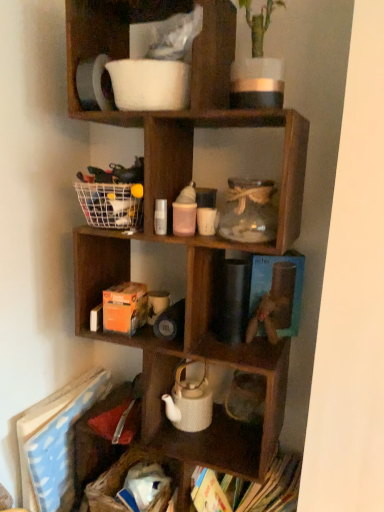
Question: Is white woven basket at lower left looking in the opposite direction of hardcover book at bottom right, which appears as the second book when viewed from the left?

Choices:
 (A) no
 (B) yes

Answer: (A)

Question: Is white woven basket at lower left at the right side of hardcover book at bottom right, which is the 1th book in right-to-left order?

Choices:
 (A) yes
 (B) no

Answer: (B)

Question: Considering the relative sizes of white woven basket at lower left and hardcover book at bottom right, which is the 1th book in right-to-left order, in the image provided, is white woven basket at lower left smaller than hardcover book at bottom right, which is the 1th book in right-to-left order,?

Choices:
 (A) no
 (B) yes

Answer: (B)

Question: Can you confirm if white woven basket at lower left is taller than hardcover book at bottom right, which appears as the second book when viewed from the left?

Choices:
 (A) no
 (B) yes

Answer: (A)

Question: Is white woven basket at lower left closer to the viewer compared to hardcover book at bottom right, which is the 1th book in right-to-left order?

Choices:
 (A) no
 (B) yes

Answer: (A)

Question: Can you confirm if white woven basket at lower left is thinner than hardcover book at bottom right, which is the 1th book in right-to-left order?

Choices:
 (A) no
 (B) yes

Answer: (B)

Question: Is wooden cube at center, acting as the 2th shelf starting from the top, at the back of white woven basket at lower left?

Choices:
 (A) no
 (B) yes

Answer: (B)

Question: From a real-world perspective, does white woven basket at lower left stand above wooden cube at center, acting as the 2th shelf starting from the top?

Choices:
 (A) yes
 (B) no

Answer: (B)

Question: Is white woven basket at lower left outside of wooden cube at center, acting as the 2th shelf starting from the top?

Choices:
 (A) no
 (B) yes

Answer: (A)

Question: Is wooden cube at center, acting as the 2th shelf starting from the top, a part of white woven basket at lower left?

Choices:
 (A) yes
 (B) no

Answer: (B)

Question: From a real-world perspective, does white woven basket at lower left sit lower than wooden cube at center, acting as the 2th shelf starting from the top?

Choices:
 (A) no
 (B) yes

Answer: (B)

Question: Does white woven basket at lower left have a smaller size compared to wooden cube at center, acting as the 2th shelf starting from the top?

Choices:
 (A) no
 (B) yes

Answer: (B)

Question: Can you confirm if white matte pitcher at upper center, placed as the first shelf when sorted from top to bottom, is positioned to the right of wooden toy at center?

Choices:
 (A) no
 (B) yes

Answer: (A)